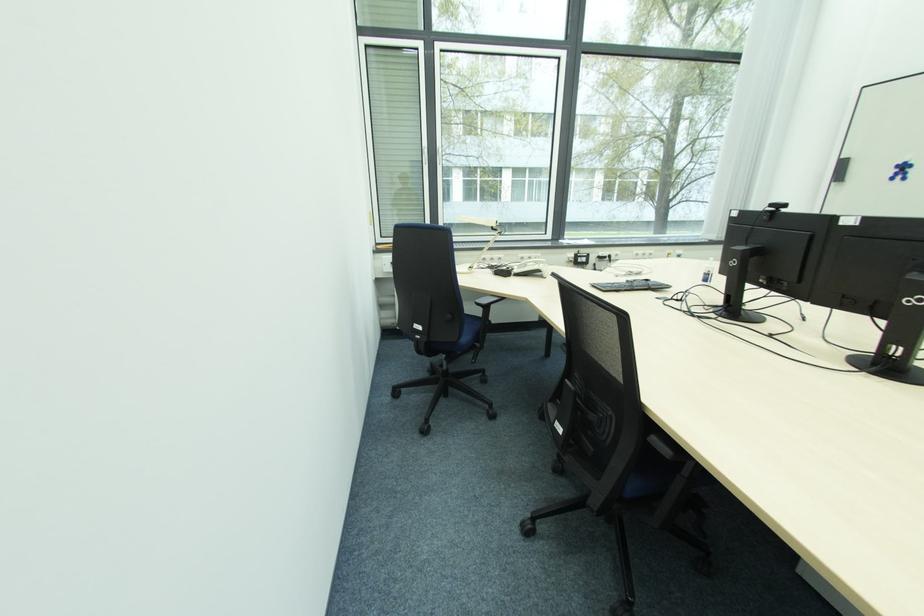
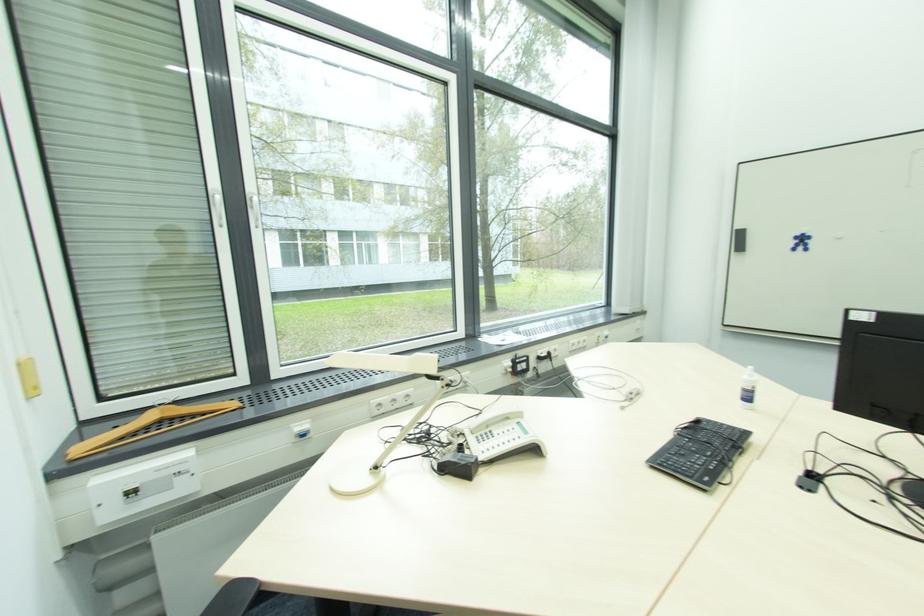
Question: I am providing you with two images of the same scene from different viewpoints. After the viewpoint changes to image2, which objects are now occluded?

Choices:
 (A) white window handle
 (B) telephone handset
 (C) black keyboard
 (D) none of these

Answer: (D)